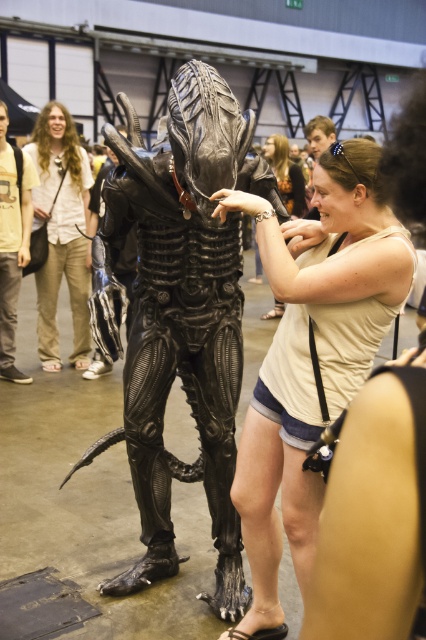
Question: Is black matte alien at center to the right of light brown fabric pants at center from the viewer's perspective?

Choices:
 (A) no
 (B) yes

Answer: (B)

Question: Which object is positioned farthest from the light brown fabric pants at center?

Choices:
 (A) black matte alien at center
 (B) white matte tank top at center
 (C) matte black tank top at center

Answer: (B)

Question: Among these objects, which one is farthest from the camera?

Choices:
 (A) matte black hair at upper center
 (B) yellow t-shirt at left
 (C) black matte alien at center

Answer: (A)

Question: Estimate the real-world distances between objects in this image. Which object is farther from the black matte alien at center?

Choices:
 (A) yellow t-shirt at left
 (B) matte black alien at center
 (C) white matte tank top at center
 (D) matte black tank top at center

Answer: (D)

Question: Does black matte alien at center appear over matte black alien at center?

Choices:
 (A) no
 (B) yes

Answer: (B)

Question: Considering the relative positions of black matte alien at center and matte black alien at center in the image provided, where is black matte alien at center located with respect to matte black alien at center?

Choices:
 (A) right
 (B) left

Answer: (B)